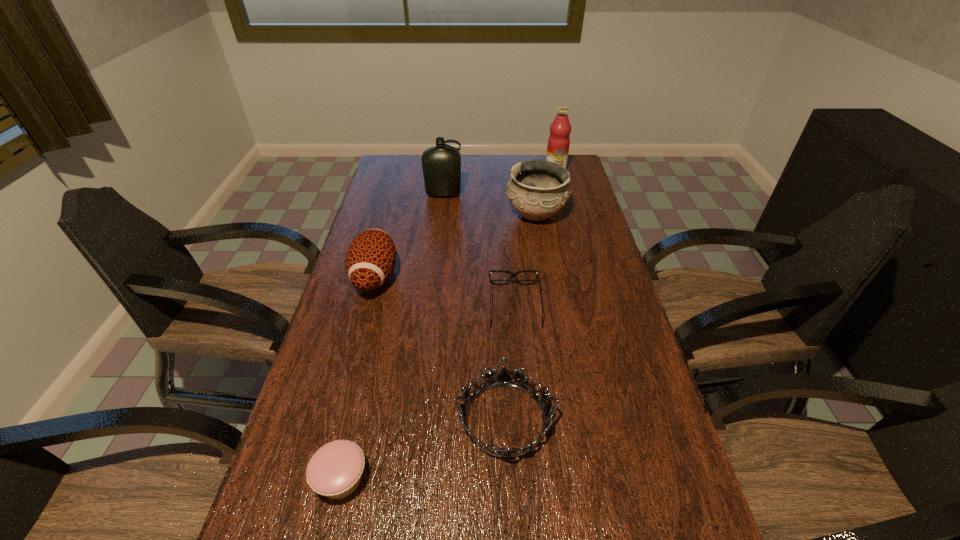
Where is `vacant space located 0.050m on the front of the fourth shortest object`? vacant space located 0.050m on the front of the fourth shortest object is located at coordinates (364, 319).

Find the location of a particular element. This screenshot has height=540, width=960. vacant space located 0.290m on the front-facing side of the tiara is located at coordinates (325, 419).

This screenshot has width=960, height=540. I want to click on free location located 0.240m on the front-facing side of the tiara, so click(x=348, y=419).

Find the location of a particular element. Image resolution: width=960 pixels, height=540 pixels. vacant region located 0.120m on the front-facing side of the tiara is located at coordinates (401, 419).

Where is `free location located 0.310m on the right of the cupcake`? free location located 0.310m on the right of the cupcake is located at coordinates (522, 479).

In order to click on vacant space located 0.200m with the lenses facing outward on the spectacles in this screenshot , I will do `click(521, 393)`.

At what (x,y) coordinates should I click in order to perform the action: click on object that is at the far edge. Please return your answer as a coordinate pair (x, y). This screenshot has height=540, width=960. Looking at the image, I should click on (559, 141).

Find the location of `football that is at the left edge`. football that is at the left edge is located at coordinates (371, 257).

Identify the location of cupcake that is at the left edge. (335, 470).

I want to click on fruit juice that is at the right edge, so click(x=559, y=141).